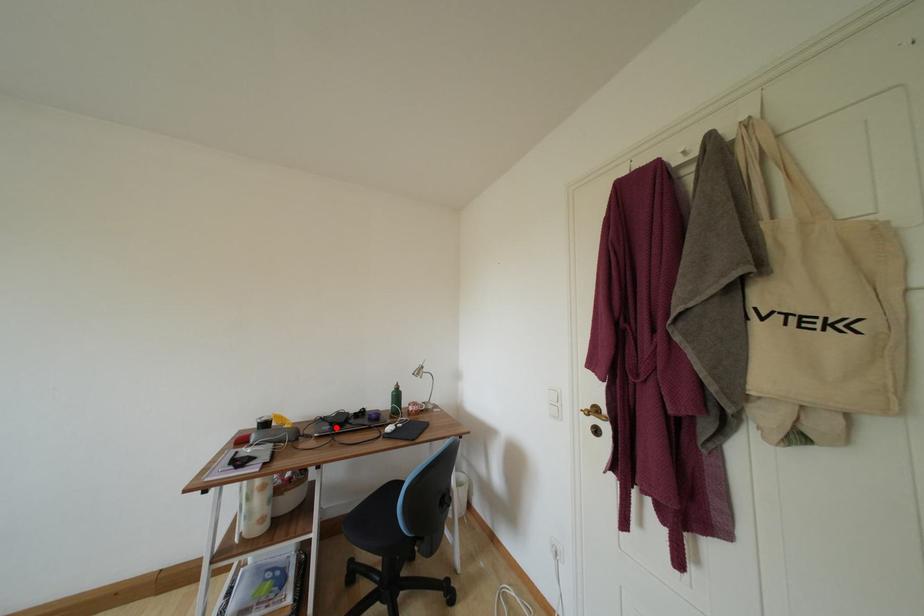
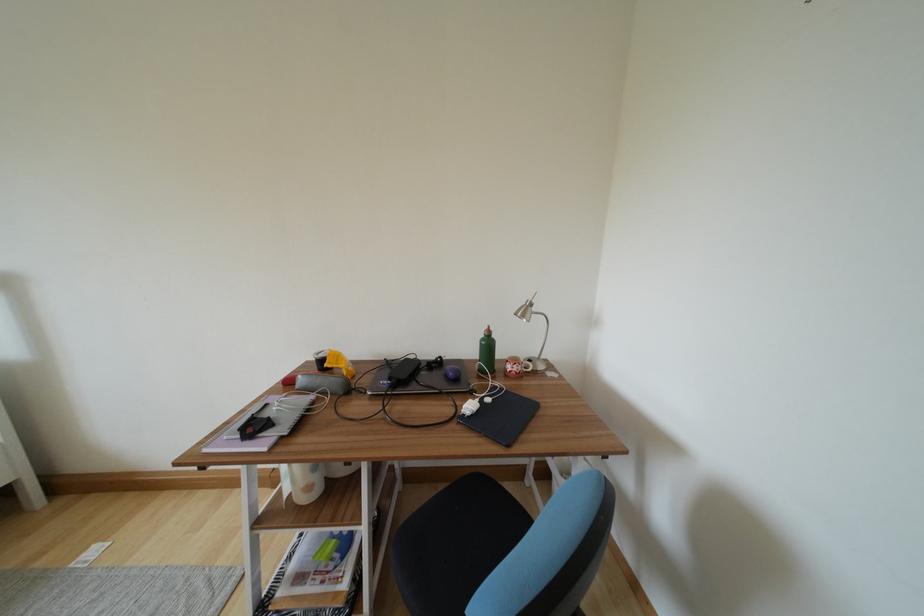
Question: I am providing you with two images of the same scene from different viewpoints. A red point is marked on the first image. Is the red point's position out of view in image 2?

Choices:
 (A) Yes
 (B) No

Answer: (B)